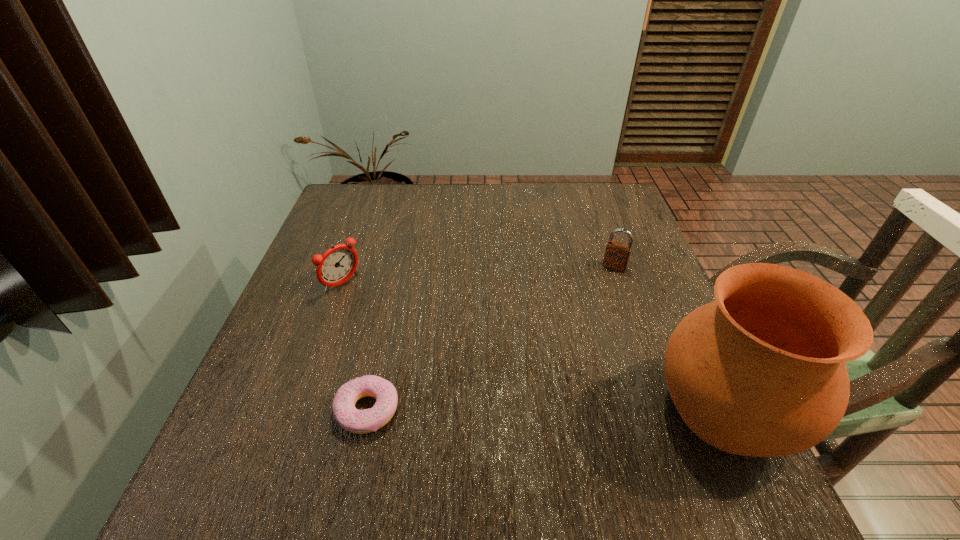
Locate an element on the screen. The image size is (960, 540). blank space that satisfies the following two spatial constraints: 1. on the front side of the tallest object; 2. on the left side of the padlock is located at coordinates (666, 410).